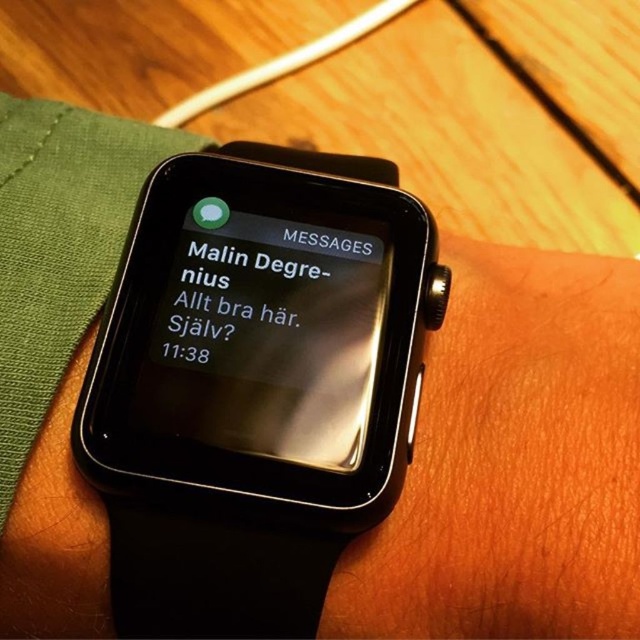
Question: Among these points, which one is nearest to the camera?

Choices:
 (A) (164, 332)
 (B) (352, 378)
 (C) (273, 250)

Answer: (B)

Question: Is black glass watch face at center positioned behind black glossy watch face at center?

Choices:
 (A) yes
 (B) no

Answer: (B)

Question: Can you confirm if black glass watch face at center is thinner than black glossy watch face at center?

Choices:
 (A) no
 (B) yes

Answer: (A)

Question: From the image, what is the correct spatial relationship of black glass watch face at center in relation to black glossy watch face at center?

Choices:
 (A) below
 (B) above

Answer: (A)

Question: Which object appears closest to the camera in this image?

Choices:
 (A) black matte smartwatch at center
 (B) black glass watch face at center
 (C) black glossy watch face at center

Answer: (A)

Question: Which of the following is the farthest from the observer?

Choices:
 (A) black glossy watch face at center
 (B) black matte smartwatch at center

Answer: (A)